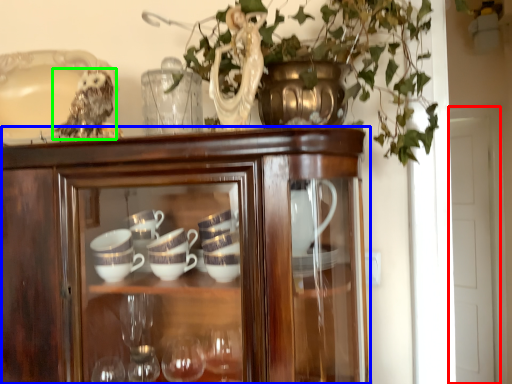
Question: Considering the real-world distances, which object is closest to glass door (highlighted by a red box)? cupboard (highlighted by a blue box) or owl (highlighted by a green box).

Choices:
 (A) cupboard
 (B) owl

Answer: (A)